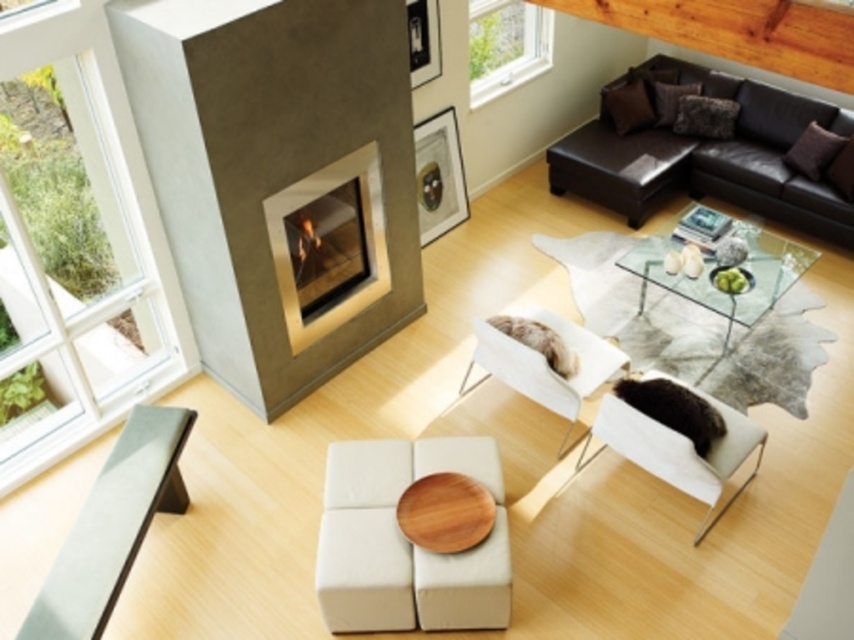
Question: Which object appears closest to the camera in this image?

Choices:
 (A) white glass window at left
 (B) dark brown leather couch at upper right
 (C) wooden stool at center

Answer: (A)

Question: Is wooden stool at center in front of clear glass window at upper center?

Choices:
 (A) no
 (B) yes

Answer: (B)

Question: Does matte glass fireplace at center have a greater width compared to white leather armchair at center?

Choices:
 (A) yes
 (B) no

Answer: (B)

Question: Is matte concrete fireplace at center closer to camera compared to clear glass window at upper center?

Choices:
 (A) no
 (B) yes

Answer: (B)

Question: Which object is positioned farthest from the clear glass window at upper center?

Choices:
 (A) white fabric armchair at lower right
 (B) white leather armchair at center
 (C) transparent glass table at center
 (D) matte glass fireplace at center

Answer: (A)

Question: Which object appears farthest from the camera in this image?

Choices:
 (A) matte concrete fireplace at center
 (B) matte glass fireplace at center
 (C) dark brown leather couch at upper right
 (D) clear glass window at upper center

Answer: (D)